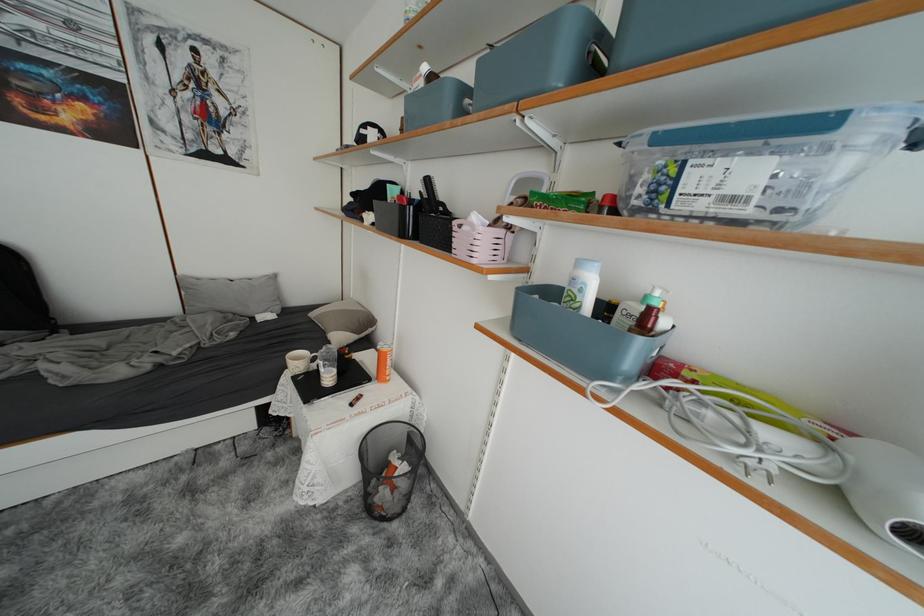
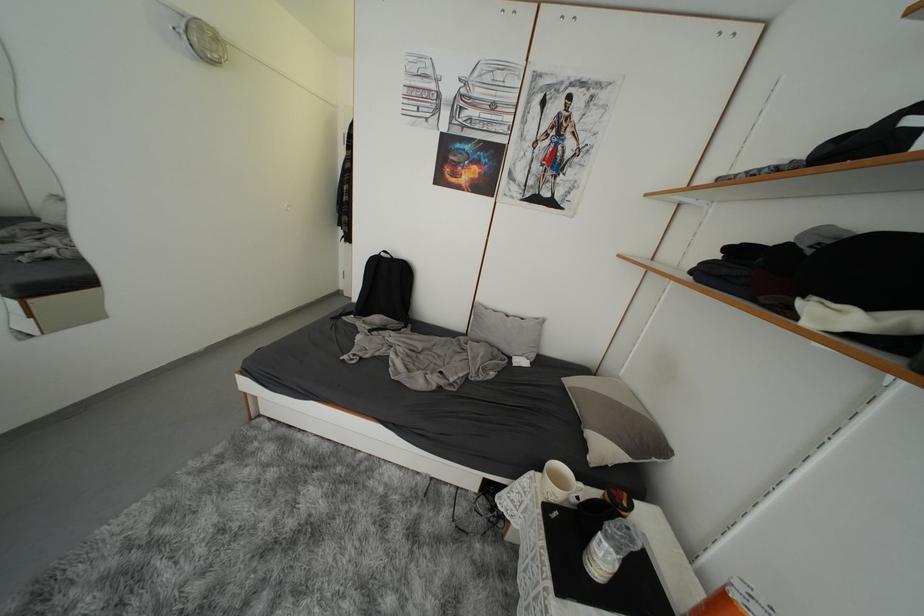
Question: Based on the continuous images, in which direction is the camera rotating? Reply with the corresponding letter.

Choices:
 (A) Left
 (B) Right
 (C) Up
 (D) Down

Answer: (A)